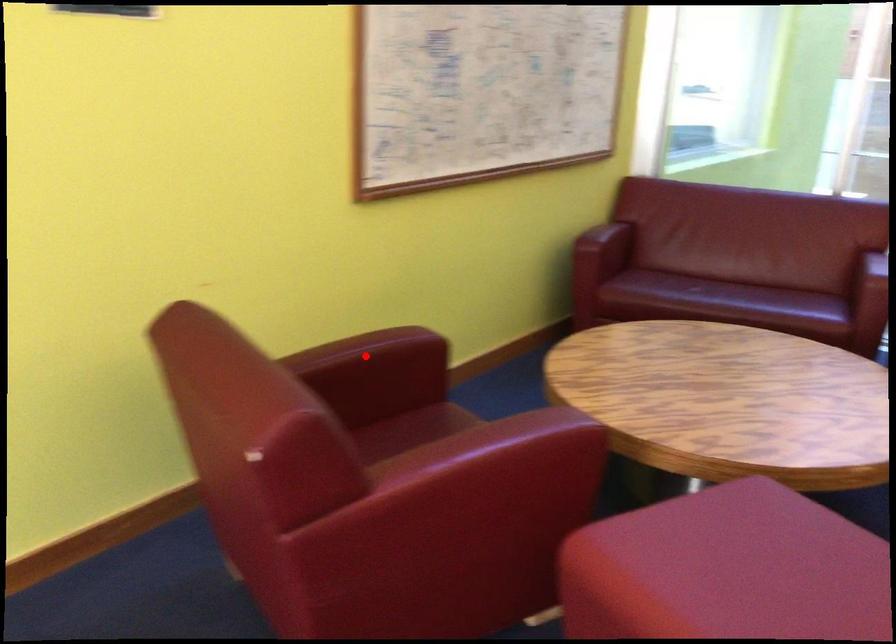
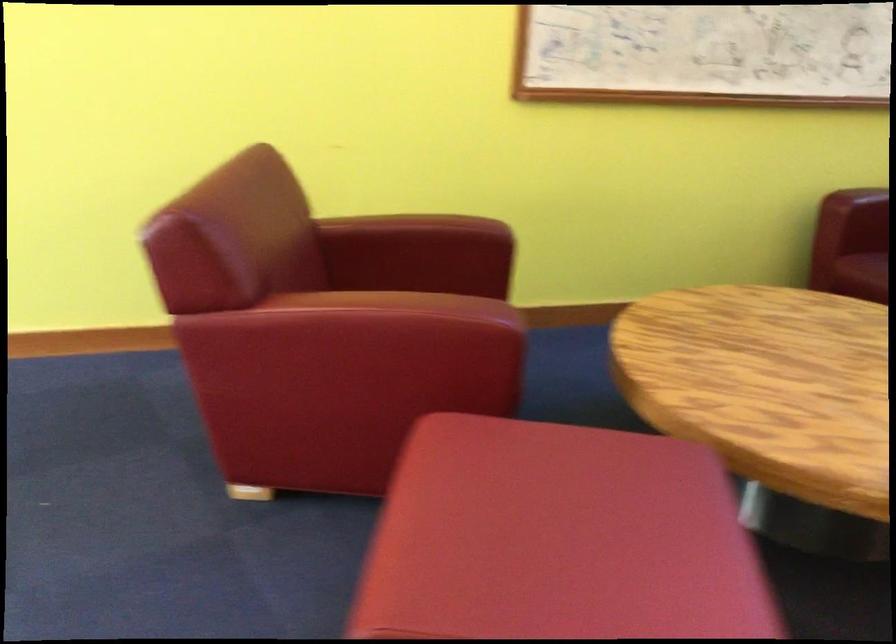
Locate, in the second image, the point that corresponds to the highlighted location in the first image.

(411, 232)